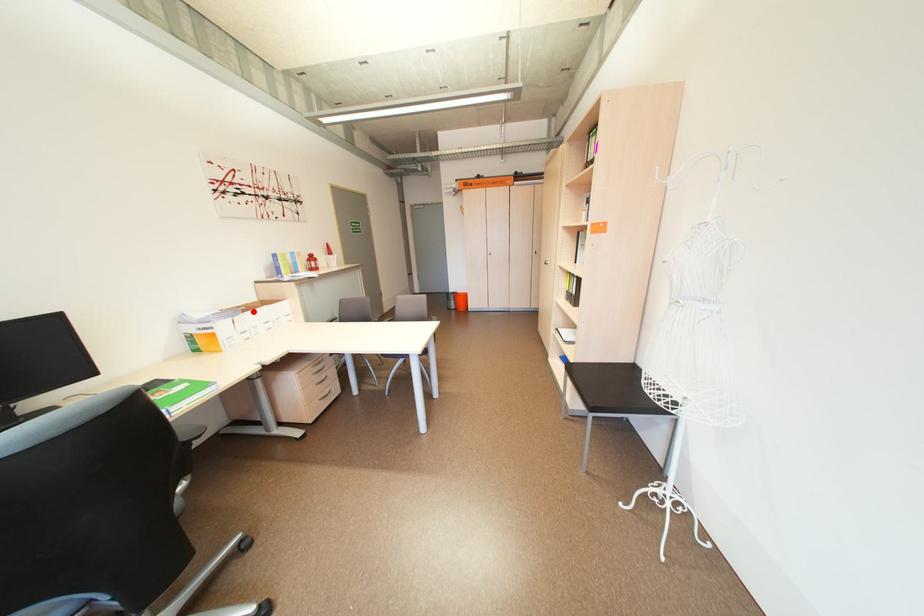
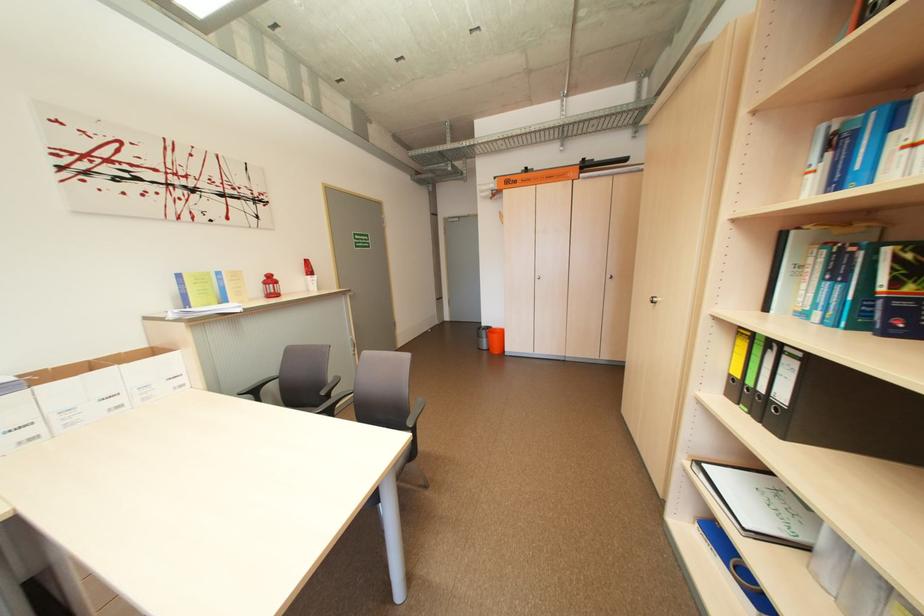
Where in the second image is the point corresponding to the highlighted location from the first image?

(43, 384)